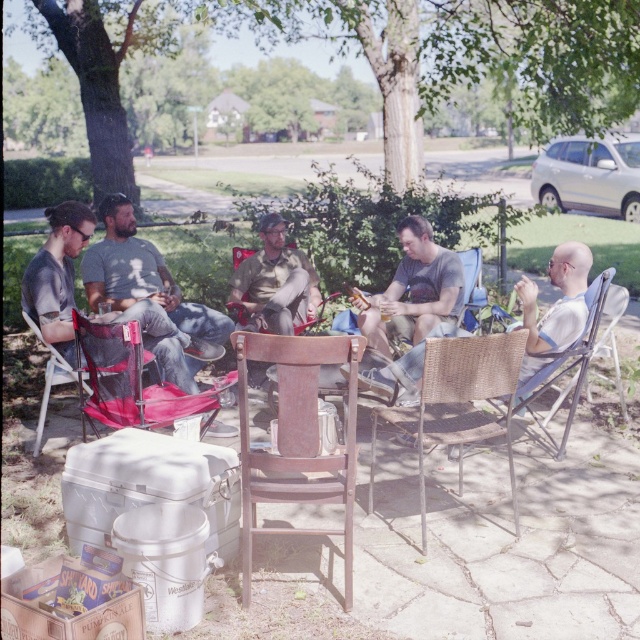
You are standing at the edge of the patio and want to move towards the wicker chair at lower right. However, there is a woven wicker chair at center in your path. Can you walk around it to reach your destination?

The woven wicker chair at center is in front of the wicker chair at lower right, so you can walk around it to reach the wicker chair at lower right.

You are standing at point (x=440, y=280) and want to walk to the wooden chair in the foreground. Is the wooden chair in the foreground blocking your path to point (x=545, y=42)?

Point (x=545, y=42) is behind point (x=440, y=280), so the wooden chair in the foreground is not blocking your path to point (x=545, y=42).

You are at an outdoor gathering and want to sit down. You have a choice between the light blue fabric chair at lower right and the matte plastic chair at center. Which chair is taller?

The light blue fabric chair at lower right is taller than the matte plastic chair at center.